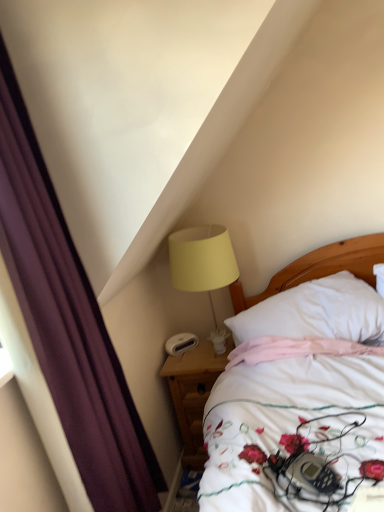
Question: Is purple fabric curtain at left taller than wooden nightstand at lower center?

Choices:
 (A) yes
 (B) no

Answer: (A)

Question: Is wooden nightstand at lower center surrounded by purple fabric curtain at left?

Choices:
 (A) no
 (B) yes

Answer: (A)

Question: Could you tell me if purple fabric curtain at left is turned towards wooden nightstand at lower center?

Choices:
 (A) yes
 (B) no

Answer: (B)

Question: Considering the relative sizes of purple fabric curtain at left and wooden nightstand at lower center in the image provided, is purple fabric curtain at left smaller than wooden nightstand at lower center?

Choices:
 (A) no
 (B) yes

Answer: (A)

Question: Does purple fabric curtain at left appear on the right side of wooden nightstand at lower center?

Choices:
 (A) no
 (B) yes

Answer: (A)

Question: Considering the relative sizes of purple fabric curtain at left and wooden nightstand at lower center in the image provided, is purple fabric curtain at left bigger than wooden nightstand at lower center?

Choices:
 (A) yes
 (B) no

Answer: (A)

Question: Does yellow fabric lampshade at upper right have a lesser height compared to purple fabric curtain at left?

Choices:
 (A) no
 (B) yes

Answer: (B)

Question: From a real-world perspective, is yellow fabric lampshade at upper right located higher than purple fabric curtain at left?

Choices:
 (A) yes
 (B) no

Answer: (B)

Question: Would you say yellow fabric lampshade at upper right is a long distance from purple fabric curtain at left?

Choices:
 (A) no
 (B) yes

Answer: (A)

Question: Does yellow fabric lampshade at upper right lie in front of purple fabric curtain at left?

Choices:
 (A) no
 (B) yes

Answer: (A)

Question: Does yellow fabric lampshade at upper right have a lesser width compared to purple fabric curtain at left?

Choices:
 (A) no
 (B) yes

Answer: (A)

Question: Can you confirm if yellow fabric lampshade at upper right is smaller than purple fabric curtain at left?

Choices:
 (A) no
 (B) yes

Answer: (B)

Question: Is wooden nightstand at lower center placed right next to white plastic alarm clock at lower center?

Choices:
 (A) yes
 (B) no

Answer: (B)